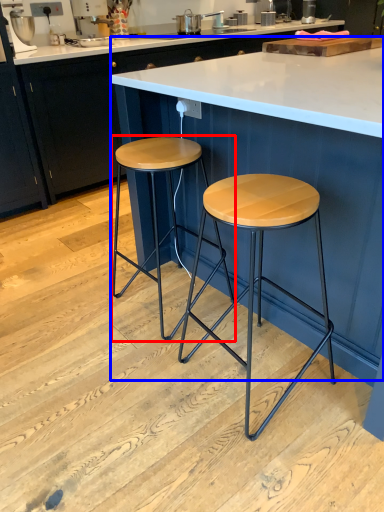
Question: Which object is further to the camera taking this photo, stool (highlighted by a red box) or table (highlighted by a blue box)?

Choices:
 (A) stool
 (B) table

Answer: (A)